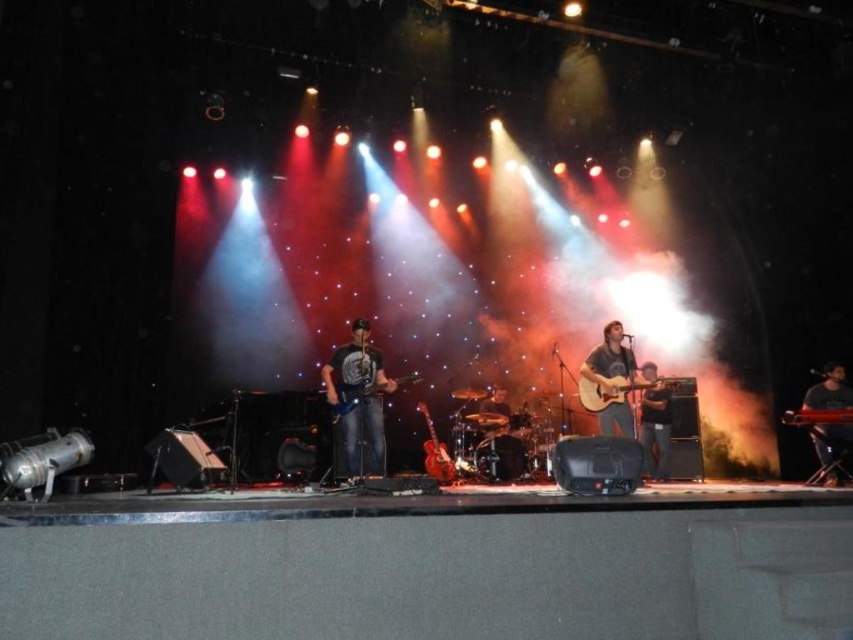
Does matte black t-shirt at center have a greater width compared to glossy wood guitar at center?

Yes.

Consider the image. Who is taller, matte black t-shirt at center or glossy wood guitar at center?

Standing taller between the two is matte black t-shirt at center.

Is point (335, 348) farther from camera compared to point (798, 417)?

That is True.

Locate an element on the screen. matte black t-shirt at center is located at coordinates (358, 400).

Is matte brown guitar at center bigger than metallic silver guitar at center?

Yes.

I want to click on matte brown guitar at center, so click(x=608, y=358).

Identify the location of matte brown guitar at center. (608, 358).

Looking at this image, is shiny black guitar at center wider than matte black guitar at center?

Correct, the width of shiny black guitar at center exceeds that of matte black guitar at center.

What do you see at coordinates (833, 448) in the screenshot? I see `shiny black guitar at center` at bounding box center [833, 448].

Identify the location of shiny black guitar at center. The height and width of the screenshot is (640, 853). [833, 448].